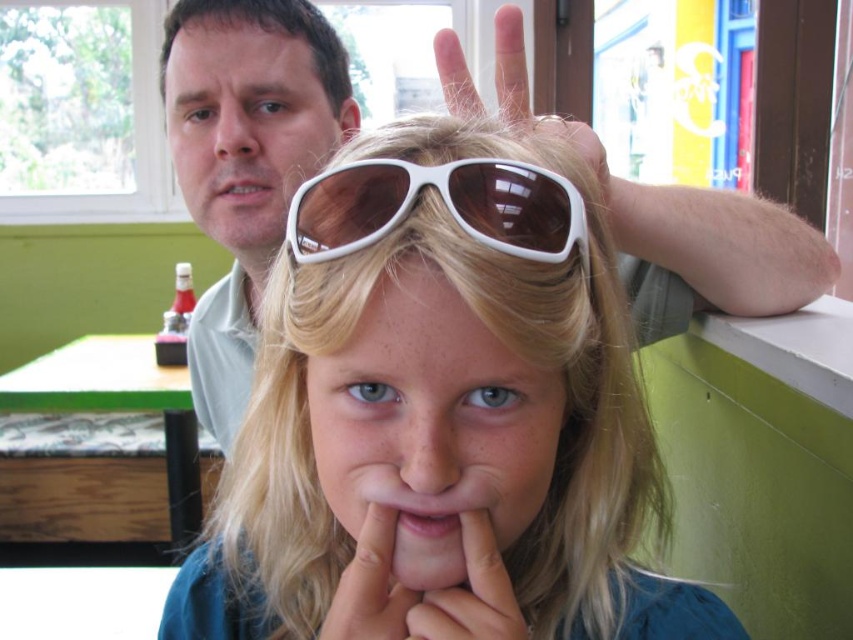
Does white plastic sunglasses at center have a lesser height compared to white matte sunglasses at center?

Incorrect, white plastic sunglasses at center's height does not fall short of white matte sunglasses at center's.

Is point (444, 125) closer to viewer compared to point (364, 230)?

That is False.

This screenshot has height=640, width=853. I want to click on white plastic sunglasses at center, so click(440, 397).

Does white matte hand at center appear on the left side of smooth skin nose at center?

Yes, white matte hand at center is to the left of smooth skin nose at center.

Is white matte hand at center above smooth skin nose at center?

Actually, white matte hand at center is below smooth skin nose at center.

This screenshot has width=853, height=640. I want to click on white matte hand at center, so (x=422, y=589).

Which is more to the right, white plastic sunglasses at center or matte skin mouth at upper center?

From the viewer's perspective, white plastic sunglasses at center appears more on the right side.

Which is more to the left, white plastic sunglasses at center or matte skin mouth at upper center?

Positioned to the left is matte skin mouth at upper center.

Where is `white plastic sunglasses at center`? white plastic sunglasses at center is located at coordinates (440, 397).